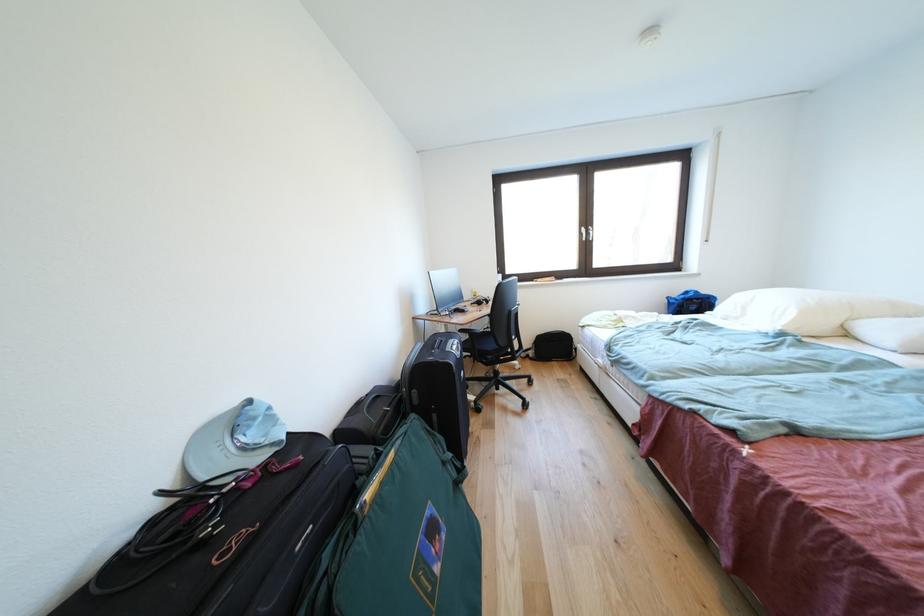
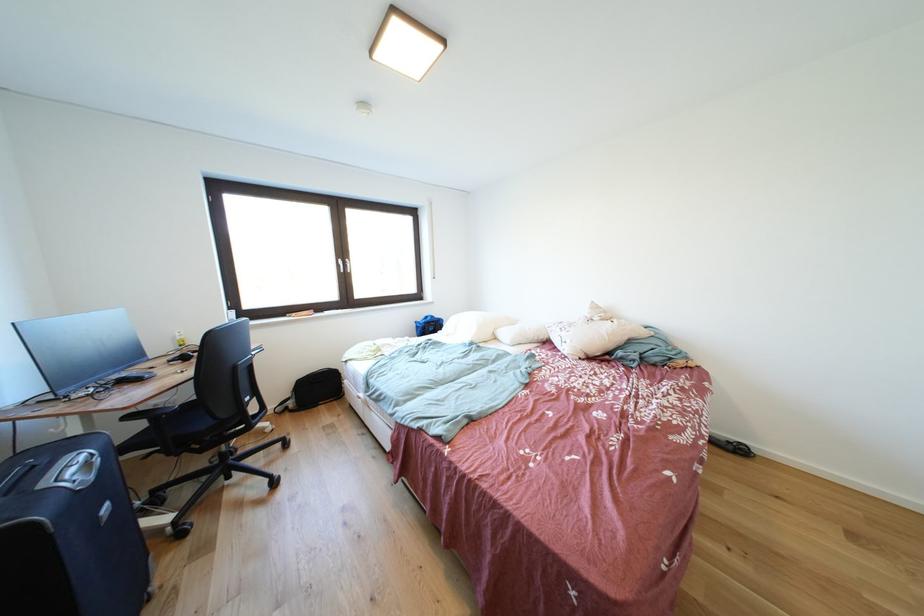
In the second image, find the point that corresponds to (x=500, y=351) in the first image.

(212, 429)